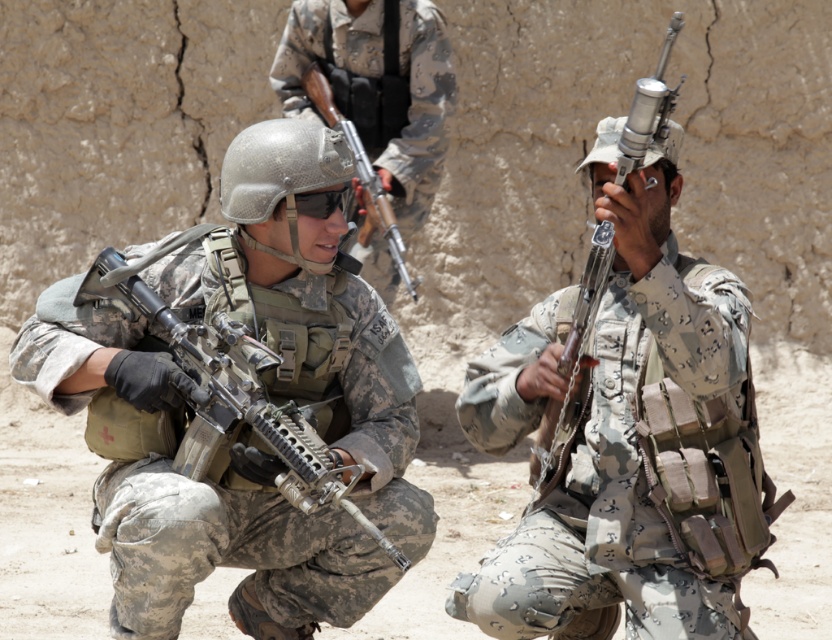
You are a drone operator observing the military exercise. You need to determine which of the two points, point (736, 634) or point (369, 51), is closer to you. Based on the scene description, which point is nearer?

Point (736, 634) is closer to the viewer than point (369, 51).

You are a drone operator observing the scene. Your mission is to identify the closest object to the viewer among the camouflage uniform at center and the cracked beige wall in the background. Which one is closer?

The camouflage uniform at center is closer to the viewer as it is only 4.23 meters away, while the cracked beige wall in the background is farther away.